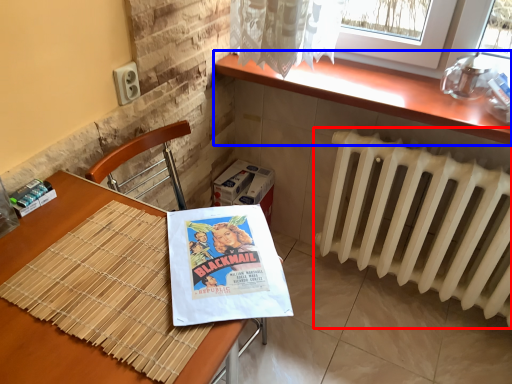
Question: Which point is further to the camera, radiator (highlighted by a red box) or counter top (highlighted by a blue box)?

Choices:
 (A) radiator
 (B) counter top

Answer: (B)